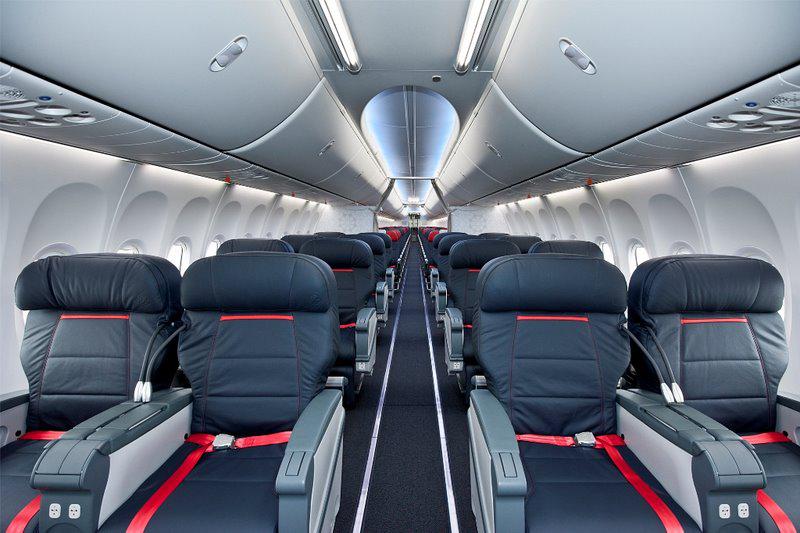
Find the location of `outlets`. outlets is located at coordinates (54, 512), (78, 513), (362, 368), (458, 364), (380, 317), (442, 316), (724, 511), (742, 512).